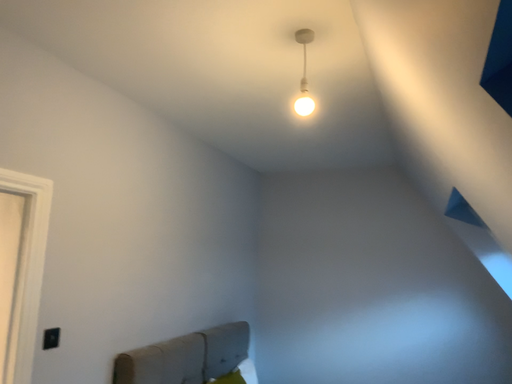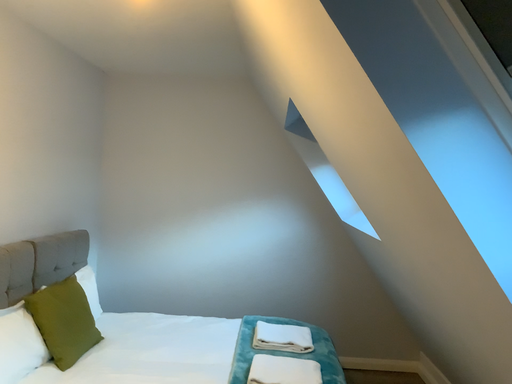
Question: Which way did the camera rotate in the video?

Choices:
 (A) rotated upward
 (B) rotated downward

Answer: (B)